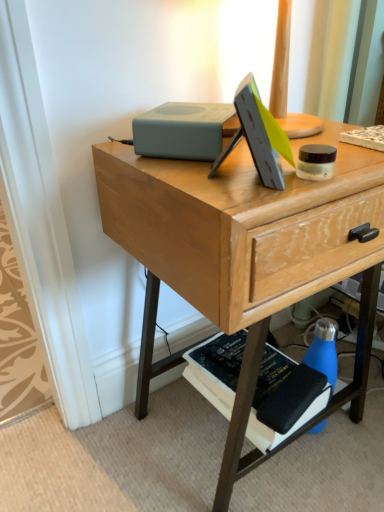
Image resolution: width=384 pixels, height=512 pixels. I want to click on free space above hardcover black book at lower right (from a real-world perspective), so click(x=259, y=365).